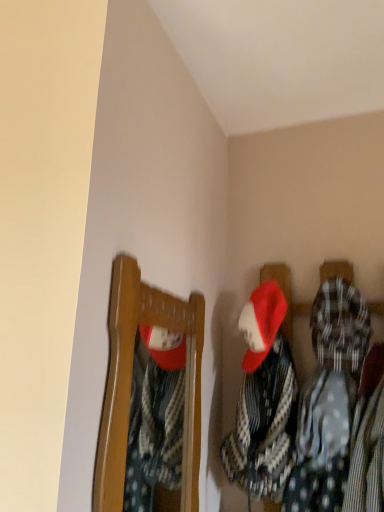
Question: Is matte wooden mirror at upper left beside white dotted fabric at center?

Choices:
 (A) no
 (B) yes

Answer: (A)

Question: Is matte wooden mirror at upper left taller than white dotted fabric at center?

Choices:
 (A) no
 (B) yes

Answer: (B)

Question: Is matte wooden mirror at upper left behind white dotted fabric at center?

Choices:
 (A) yes
 (B) no

Answer: (B)

Question: Considering the relative sizes of matte wooden mirror at upper left and white dotted fabric at center in the image provided, is matte wooden mirror at upper left thinner than white dotted fabric at center?

Choices:
 (A) no
 (B) yes

Answer: (B)

Question: Considering the relative sizes of matte wooden mirror at upper left and white dotted fabric at center in the image provided, is matte wooden mirror at upper left bigger than white dotted fabric at center?

Choices:
 (A) yes
 (B) no

Answer: (B)

Question: Is matte wooden mirror at upper left at the right side of white dotted fabric at center?

Choices:
 (A) no
 (B) yes

Answer: (A)

Question: Does white dotted fabric at center lie behind matte wooden mirror at upper left?

Choices:
 (A) no
 (B) yes

Answer: (B)

Question: Is the depth of white dotted fabric at center less than that of matte wooden mirror at upper left?

Choices:
 (A) yes
 (B) no

Answer: (B)

Question: Could you tell me if white dotted fabric at center is facing matte wooden mirror at upper left?

Choices:
 (A) no
 (B) yes

Answer: (A)

Question: Would you say white dotted fabric at center is a long distance from matte wooden mirror at upper left?

Choices:
 (A) yes
 (B) no

Answer: (B)

Question: Is white dotted fabric at center bigger than matte wooden mirror at upper left?

Choices:
 (A) no
 (B) yes

Answer: (B)

Question: From the image's perspective, is white dotted fabric at center located beneath matte wooden mirror at upper left?

Choices:
 (A) yes
 (B) no

Answer: (A)

Question: From a real-world perspective, relative to matte wooden mirror at upper left, is white dotted fabric at center vertically above or below?

Choices:
 (A) below
 (B) above

Answer: (A)